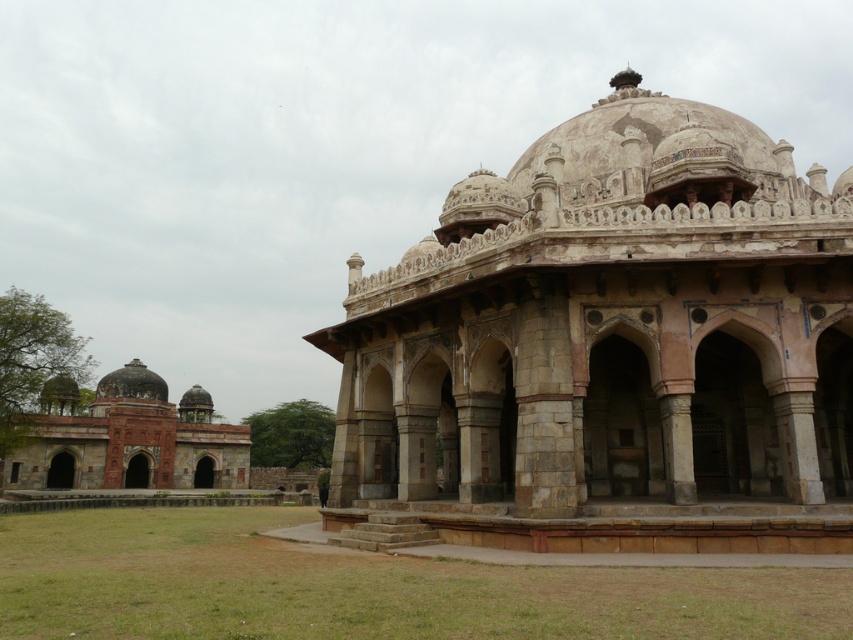
Question: Which point is farther from the camera taking this photo?

Choices:
 (A) (80, 435)
 (B) (525, 436)

Answer: (A)

Question: Which object appears closest to the camera in this image?

Choices:
 (A) stone dome at center
 (B) reddish-brown stone domes at left

Answer: (A)

Question: Does stone dome at center have a larger size compared to reddish-brown stone domes at left?

Choices:
 (A) no
 (B) yes

Answer: (B)

Question: Is stone dome at center bigger than reddish-brown stone domes at left?

Choices:
 (A) no
 (B) yes

Answer: (B)

Question: In this image, where is stone dome at center located relative to reddish-brown stone domes at left?

Choices:
 (A) below
 (B) above

Answer: (B)